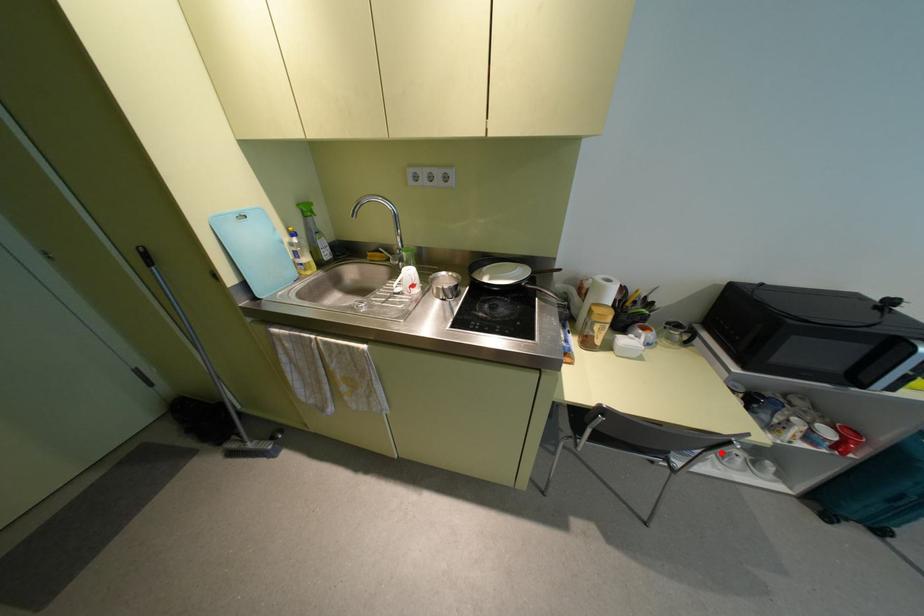
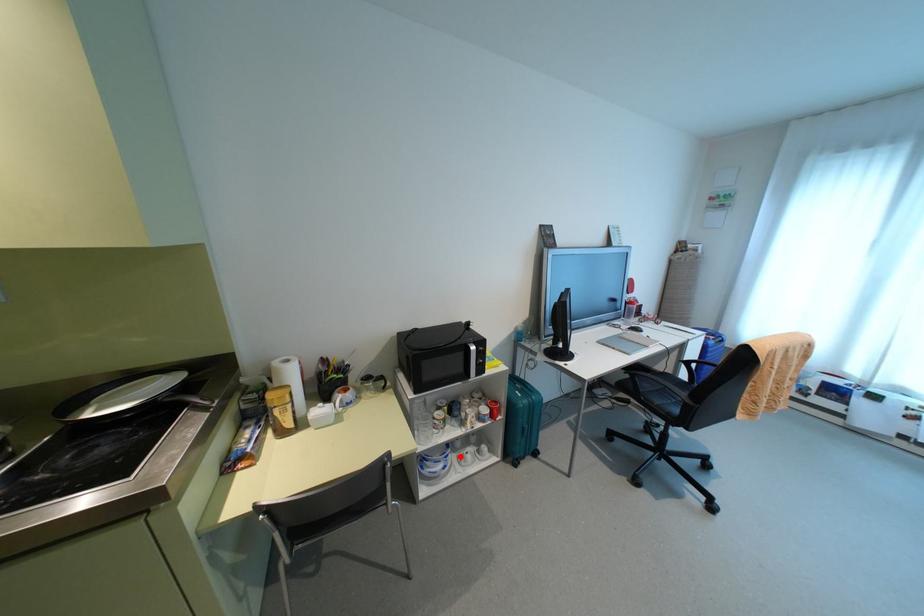
I am providing you with two images of the same scene from different viewpoints. A red point is marked on the first image and another point is marked on the second image. Do the highlighted points in image1 and image2 indicate the same real-world spot?

Yes